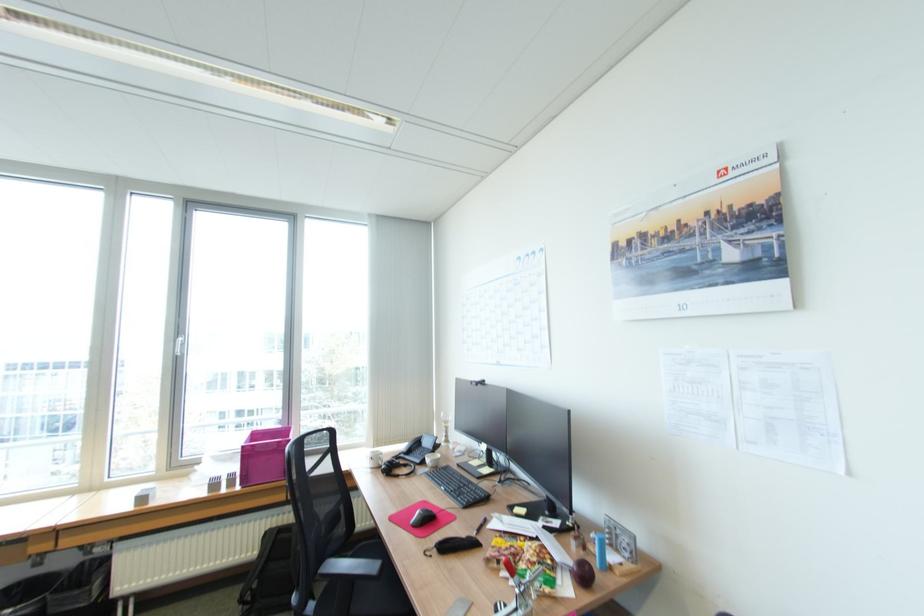
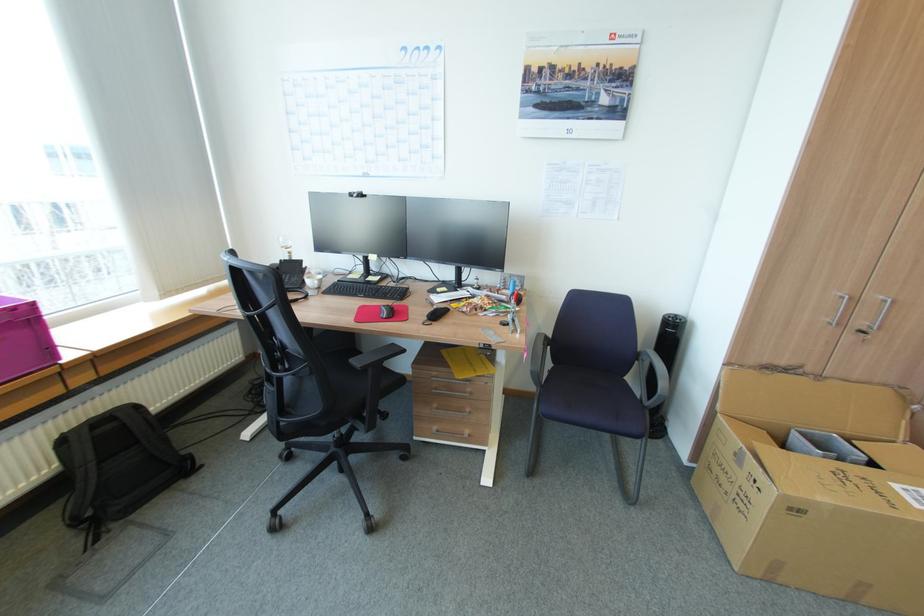
Locate, in the second image, the point that corresponds to (x=426, y=513) in the first image.

(391, 308)